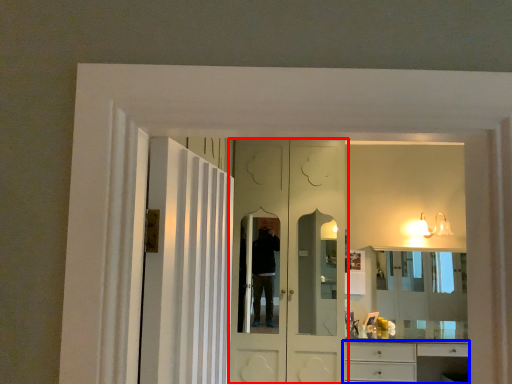
Question: Among these objects, which one is nearest to the camera, door (highlighted by a red box) or cabinetry (highlighted by a blue box)?

Choices:
 (A) door
 (B) cabinetry

Answer: (A)